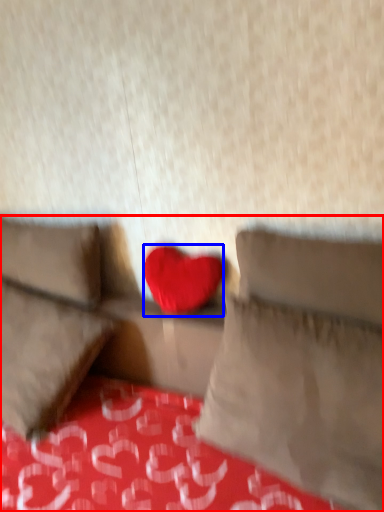
Question: Which point is closer to the camera, studio couch (highlighted by a red box) or heart (highlighted by a blue box)?

Choices:
 (A) studio couch
 (B) heart

Answer: (A)